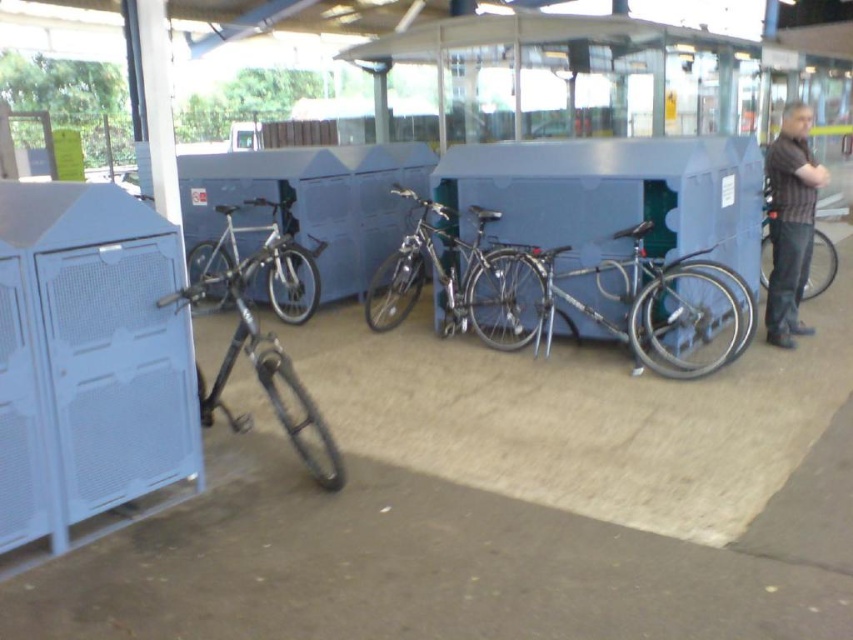
How distant is shiny metallic bicycle at center from silver metallic bicycle at center?

shiny metallic bicycle at center is 7.37 feet away from silver metallic bicycle at center.

Between shiny metallic bicycle at center and silver metallic bicycle at center, which one is positioned higher?

silver metallic bicycle at center

Image resolution: width=853 pixels, height=640 pixels. I want to click on shiny metallic bicycle at center, so click(622, 301).

Which is more to the right, shiny silver bicycle at center or silver metallic bicycle at center?

From the viewer's perspective, shiny silver bicycle at center appears more on the right side.

Measure the distance between shiny silver bicycle at center and silver metallic bicycle at center.

shiny silver bicycle at center is 3.58 feet from silver metallic bicycle at center.

Who is more forward, (465, 310) or (306, 320)?

Positioned in front is point (465, 310).

This screenshot has height=640, width=853. I want to click on shiny silver bicycle at center, so click(x=451, y=278).

Which is below, shiny metallic bicycle at center or matte black bicycle at right?

Positioned lower is shiny metallic bicycle at center.

The image size is (853, 640). What do you see at coordinates (622, 301) in the screenshot? I see `shiny metallic bicycle at center` at bounding box center [622, 301].

Is point (573, 304) farther from viewer compared to point (817, 236)?

No, it is in front of (817, 236).

Identify the location of shiny metallic bicycle at center. Image resolution: width=853 pixels, height=640 pixels. (622, 301).